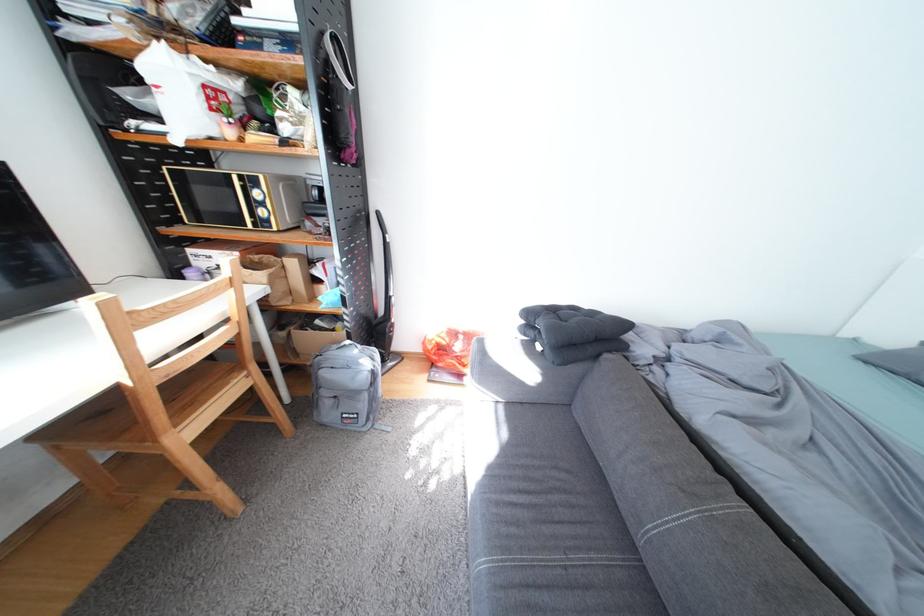
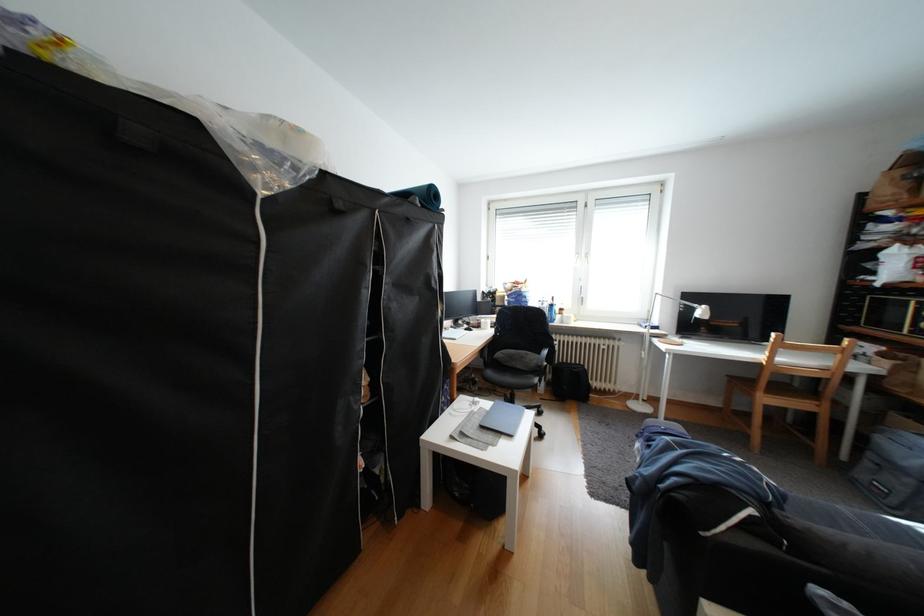
The point at (200, 434) is marked in the first image. Where is the corresponding point in the second image?

(779, 400)